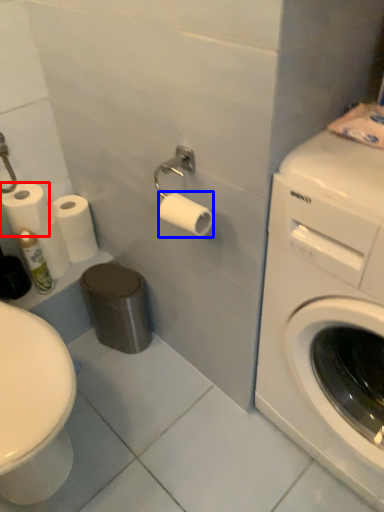
Question: Which point is closer to the camera, toilet paper (highlighted by a red box) or toilet paper (highlighted by a blue box)?

Choices:
 (A) toilet paper
 (B) toilet paper

Answer: (B)